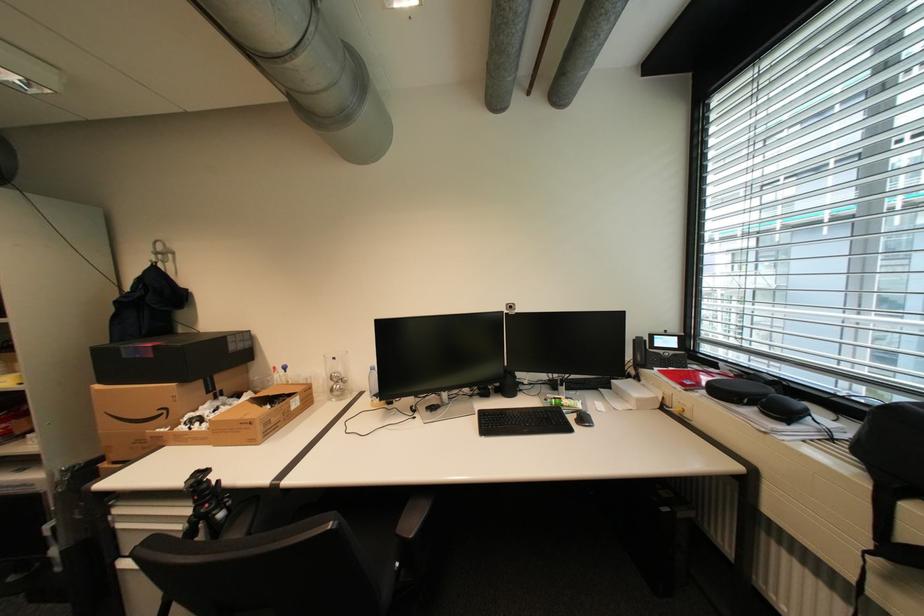
What do you see at coordinates (205, 505) in the screenshot? The width and height of the screenshot is (924, 616). I see `the tripod adjustment knob` at bounding box center [205, 505].